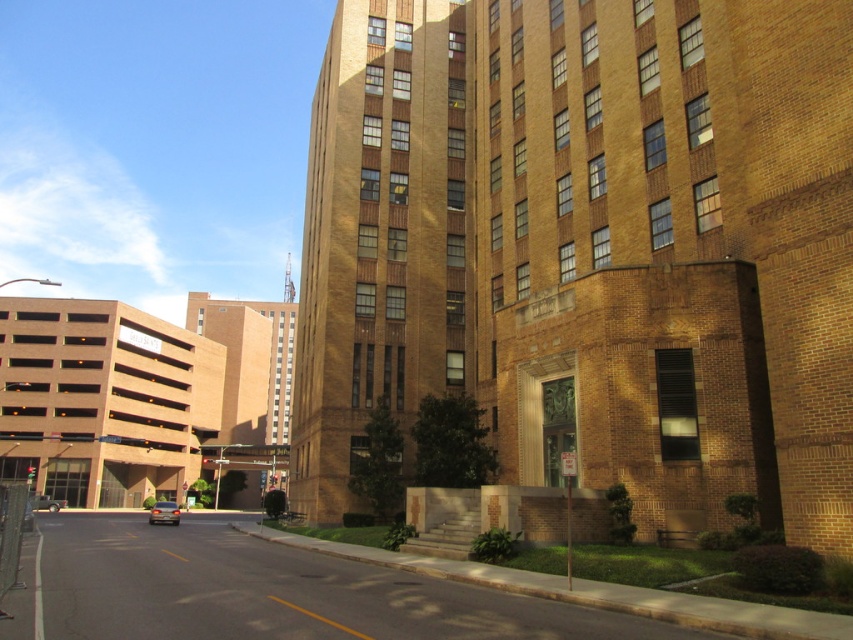
You are a delivery driver who needs to park your shiny silver sedan at center in a parking spot that can only accommodate vehicles narrower than the silver metallic car at lower left. Based on the scene, will your sedan fit?

The shiny silver sedan at center is wider than the silver metallic car at lower left. Since the parking spot requires vehicles narrower than the silver metallic car at lower left, the shiny silver sedan at center will not fit in the parking spot.

You are a pedestrian standing at the entrance of the large brick building. You see a shiny silver sedan at center and a silver metallic car at lower left. Which car is closer to the building?

The shiny silver sedan at center is located above the silver metallic car at lower left, meaning it is closer to the building.